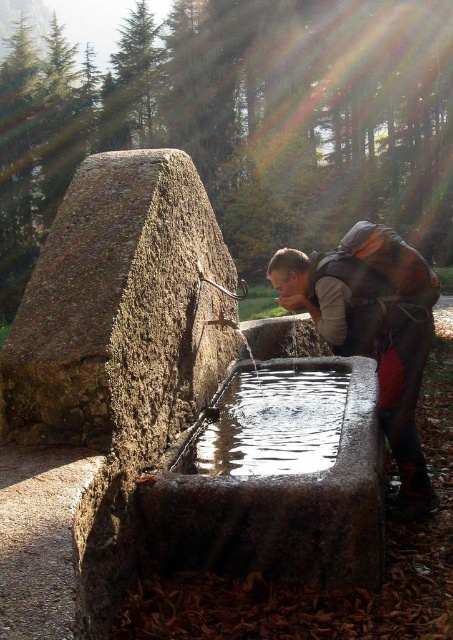
In the scene shown: You are a hiker who wants to refill your water bottle. You see the granite water trough at center and the clear glass water at center. Which object should you approach to get water?

The clear glass water at center is the actual water source, so you should approach the clear glass water at center to get water.

You are a hiker who wants to refill your water bottle. The rough textured stone at center is where the water flows into the basin. Can you reach the water source from that stone?

The rough textured stone at center is positioned at point (119, 308), so yes, you can reach the water source from that stone as it is located at the basin where the water flows.

You are a hiker who wants to store your matte gray backpack at lower right near the granite water trough at center. Considering their sizes, which object has a larger width and can potentially accommodate the other?

The granite water trough at center has a larger width than the matte gray backpack at lower right, so it might be able to accommodate the backpack.